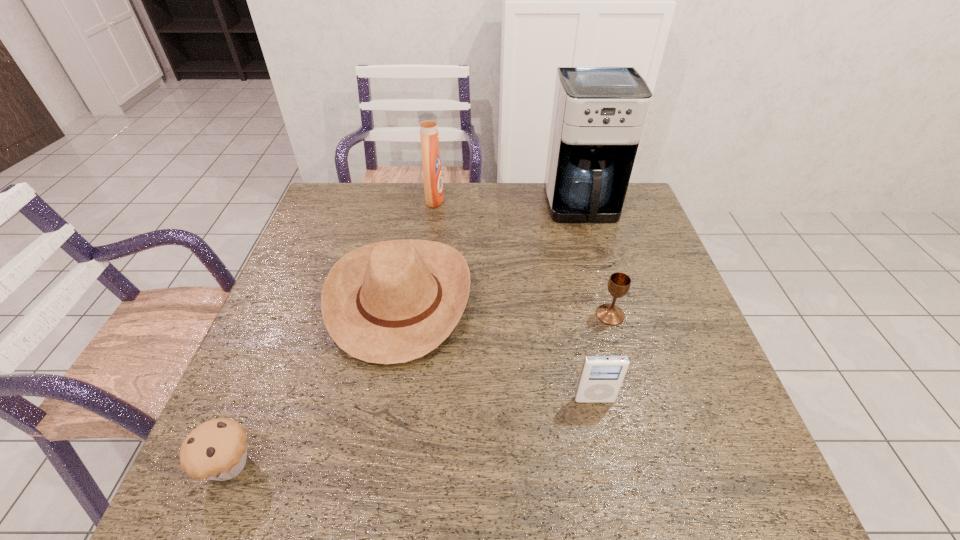
Identify the location of vacant space situated 0.100m on the front-facing side of the iPod. (605, 450).

Locate an element on the screen. The image size is (960, 540). vacant space located on the left of the second shortest object is located at coordinates click(x=455, y=315).

Find the location of `blank area located 0.230m on the right of the leftmost object`. blank area located 0.230m on the right of the leftmost object is located at coordinates (381, 464).

You are a GUI agent. You are given a task and a screenshot of the screen. Output one action in this format:
    pyautogui.click(x=<x>, y=<y>)
    Task: Click on the coffee maker that is positioned at the far edge
    The image size is (960, 540).
    Given the screenshot: What is the action you would take?
    pyautogui.click(x=599, y=112)

Where is `detergent situated at the far edge`? The height and width of the screenshot is (540, 960). detergent situated at the far edge is located at coordinates (432, 172).

Find the location of a particular element. object that is at the near edge is located at coordinates (217, 449).

This screenshot has width=960, height=540. In order to click on cowboy hat that is at the left edge in this screenshot , I will do `click(389, 302)`.

At what (x,y) coordinates should I click in order to perform the action: click on muffin positioned at the left edge. Please return your answer as a coordinate pair (x, y). This screenshot has width=960, height=540. Looking at the image, I should click on (217, 449).

Locate an element on the screen. This screenshot has width=960, height=540. coffee maker that is at the right edge is located at coordinates (599, 112).

This screenshot has height=540, width=960. Find the location of `chalice located at the right edge`. chalice located at the right edge is located at coordinates [x=619, y=283].